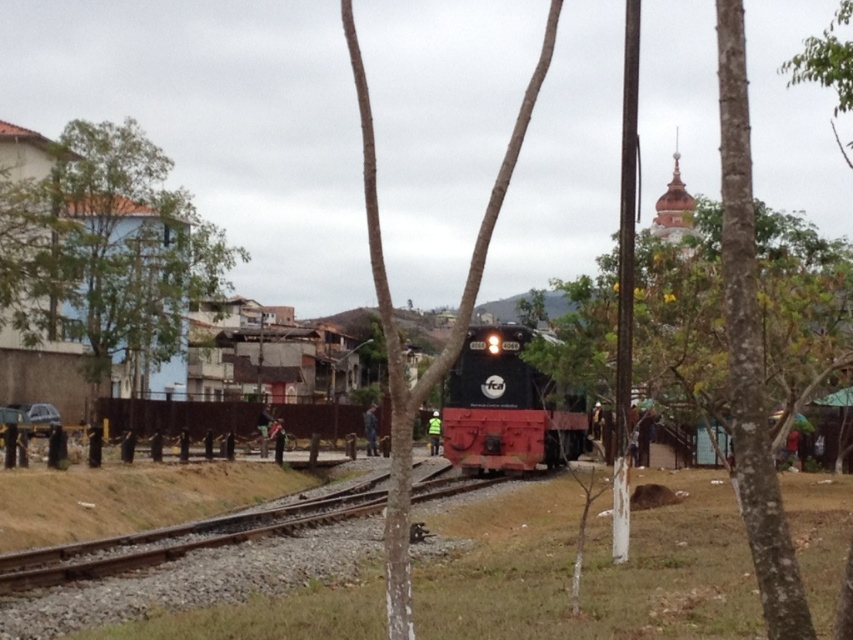
Between green leafy tree at left and black glossy locomotive at center, which one has more height?

Standing taller between the two is green leafy tree at left.

Between point (138, 259) and point (444, 400), which one is positioned in front?

Point (444, 400) is more forward.

Is point (74, 172) positioned in front of point (534, 413)?

No, (74, 172) is behind (534, 413).

I want to click on green leafy tree at left, so click(x=103, y=246).

Is point (161, 285) in front of point (401, 448)?

No, (161, 285) is behind (401, 448).

Is green leafy tree at left smaller than smooth bark tree at center?

Correct, green leafy tree at left occupies less space than smooth bark tree at center.

Is point (0, 225) positioned before point (374, 260)?

No, (0, 225) is further to viewer.

This screenshot has width=853, height=640. In order to click on green leafy tree at left in this screenshot , I will do `click(103, 246)`.

Can you confirm if smooth bark tree at center is thinner than black glossy locomotive at center?

Incorrect, smooth bark tree at center's width is not less than black glossy locomotive at center's.

Between smooth bark tree at center and black glossy locomotive at center, which one appears on the right side from the viewer's perspective?

Positioned to the right is black glossy locomotive at center.

Describe the element at coordinates (395, 323) in the screenshot. This screenshot has height=640, width=853. I see `smooth bark tree at center` at that location.

What are the coordinates of `smooth bark tree at center` in the screenshot? It's located at 395,323.